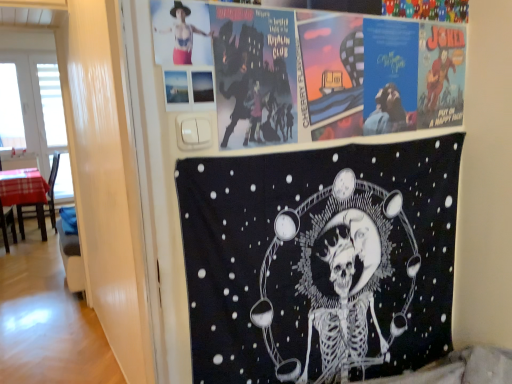
What do you see at coordinates (319, 261) in the screenshot? The width and height of the screenshot is (512, 384). I see `black fabric poster at upper center, the second poster from the top` at bounding box center [319, 261].

You are a GUI agent. You are given a task and a screenshot of the screen. Output one action in this format:
    pyautogui.click(x=<x>, y=<y>)
    Task: Click on the matte black and pink fabric at upper left
    
    Given the screenshot: What is the action you would take?
    pyautogui.click(x=181, y=32)

What is the approximate height of white plastic window screen at left?

It is 2.23 meters.

You are a GUI agent. You are given a task and a screenshot of the screen. Output one action in this format:
    pyautogui.click(x=<x>, y=<y>)
    Task: Click on the white plastic window screen at left
    
    Given the screenshot: What is the action you would take?
    (51, 118)

Describe the element at coordinates (317, 71) in the screenshot. This screenshot has width=512, height=384. I see `matte paper poster at upper center, positioned as the first poster in top-to-bottom order` at that location.

This screenshot has height=384, width=512. What do you see at coordinates (41, 205) in the screenshot?
I see `plaid fabric chair at left` at bounding box center [41, 205].

Find the location of `black fabric poster at upper center, which ranks as the first poster in bottom-to-top order`. black fabric poster at upper center, which ranks as the first poster in bottom-to-top order is located at coordinates (319, 261).

From the image's perspective, is black fabric poster at upper center, the second poster from the top, located above or below white plastic window screen at left?

Based on their image positions, black fabric poster at upper center, the second poster from the top, is located beneath white plastic window screen at left.

In the image, is black fabric poster at upper center, the second poster from the top, positioned in front of or behind white plastic window screen at left?

Clearly, black fabric poster at upper center, the second poster from the top, is in front of white plastic window screen at left.

Between black fabric poster at upper center, the second poster from the top, and white plastic window screen at left, which one has larger width?

With larger width is white plastic window screen at left.

In terms of height, does black fabric poster at upper center, which ranks as the first poster in bottom-to-top order, look taller or shorter compared to white plastic window screen at left?

Clearly, black fabric poster at upper center, which ranks as the first poster in bottom-to-top order, is shorter compared to white plastic window screen at left.

How many degrees apart are the facing directions of plaid fabric chair at left and black fabric poster at upper center, the second poster from the top?

The angular difference between plaid fabric chair at left and black fabric poster at upper center, the second poster from the top, is 86 degrees.

Do you think plaid fabric chair at left is within black fabric poster at upper center, which ranks as the first poster in bottom-to-top order, or outside of it?

The correct answer is: outside.

Is plaid fabric chair at left at the left side of black fabric poster at upper center, the second poster from the top?

Indeed, plaid fabric chair at left is positioned on the left side of black fabric poster at upper center, the second poster from the top.

From a real-world perspective, between plaid fabric chair at left and black fabric poster at upper center, the second poster from the top, who is vertically lower?

plaid fabric chair at left is physically lower.

In the image, is matte paper poster at upper center, the second poster when ordered from bottom to top, positioned in front of or behind matte black and pink fabric at upper left?

Clearly, matte paper poster at upper center, the second poster when ordered from bottom to top, is behind matte black and pink fabric at upper left.

From a real-world perspective, which object rests below the other?

matte paper poster at upper center, positioned as the first poster in top-to-bottom order, from a real-world perspective.

Would you say matte paper poster at upper center, positioned as the first poster in top-to-bottom order, contains matte black and pink fabric at upper left?

No, matte paper poster at upper center, positioned as the first poster in top-to-bottom order, does not contain matte black and pink fabric at upper left.

Is point (348, 44) positioned before point (180, 32)?

No, (348, 44) is further to viewer.

Which is in front, matte black and pink fabric at upper left or matte paper poster at upper center, positioned as the first poster in top-to-bottom order?

matte black and pink fabric at upper left is more forward.

Consider the image. Is matte black and pink fabric at upper left outside of matte paper poster at upper center, positioned as the first poster in top-to-bottom order?

matte black and pink fabric at upper left lies outside matte paper poster at upper center, positioned as the first poster in top-to-bottom order,'s area.

In the scene shown: Is matte black and pink fabric at upper left not near matte paper poster at upper center, the second poster when ordered from bottom to top?

Actually, matte black and pink fabric at upper left and matte paper poster at upper center, the second poster when ordered from bottom to top, are a little close together.

Between matte black and pink fabric at upper left and matte paper poster at upper center, the second poster when ordered from bottom to top, which one has larger size?

With larger size is matte paper poster at upper center, the second poster when ordered from bottom to top.

Measure the distance from black fabric poster at upper center, which ranks as the first poster in bottom-to-top order, to matte paper poster at upper center, positioned as the first poster in top-to-bottom order.

They are 10.80 inches apart.

Do you think black fabric poster at upper center, the second poster from the top, is within matte paper poster at upper center, positioned as the first poster in top-to-bottom order, or outside of it?

black fabric poster at upper center, the second poster from the top, lies outside matte paper poster at upper center, positioned as the first poster in top-to-bottom order.

Identify the location of poster positioned vertically above the black fabric poster at upper center, the second poster from the top (from a real-world perspective). The height and width of the screenshot is (384, 512). (317, 71).

Considering the positions of points (374, 237) and (243, 90), is point (374, 237) closer to camera compared to point (243, 90)?

No, (374, 237) is further to viewer.

What are the coordinates of `person above the black fabric poster at upper center, the second poster from the top (from a real-world perspective)` in the screenshot? It's located at (181, 32).

Consider the image. Is matte black and pink fabric at upper left bigger than black fabric poster at upper center, which ranks as the first poster in bottom-to-top order?

No, matte black and pink fabric at upper left is not bigger than black fabric poster at upper center, which ranks as the first poster in bottom-to-top order.

Consider the image. Considering the sizes of objects matte black and pink fabric at upper left and black fabric poster at upper center, which ranks as the first poster in bottom-to-top order, in the image provided, who is taller, matte black and pink fabric at upper left or black fabric poster at upper center, which ranks as the first poster in bottom-to-top order,?

With more height is black fabric poster at upper center, which ranks as the first poster in bottom-to-top order.

Is matte black and pink fabric at upper left turned away from black fabric poster at upper center, which ranks as the first poster in bottom-to-top order?

No, matte black and pink fabric at upper left is not facing away from black fabric poster at upper center, which ranks as the first poster in bottom-to-top order.

Considering the relative positions of plaid fabric chair at left and matte paper poster at upper center, the second poster when ordered from bottom to top, in the image provided, is plaid fabric chair at left to the left or to the right of matte paper poster at upper center, the second poster when ordered from bottom to top,?

In the image, plaid fabric chair at left appears on the left side of matte paper poster at upper center, the second poster when ordered from bottom to top.

Considering the sizes of objects plaid fabric chair at left and matte paper poster at upper center, positioned as the first poster in top-to-bottom order, in the image provided, who is taller, plaid fabric chair at left or matte paper poster at upper center, positioned as the first poster in top-to-bottom order,?

plaid fabric chair at left is taller.

Which of these two, plaid fabric chair at left or matte paper poster at upper center, the second poster when ordered from bottom to top, is thinner?

matte paper poster at upper center, the second poster when ordered from bottom to top, is thinner.

Is plaid fabric chair at left positioned in front of matte paper poster at upper center, the second poster when ordered from bottom to top?

No, plaid fabric chair at left is behind matte paper poster at upper center, the second poster when ordered from bottom to top.

Where is `the 1st poster counting from the right side of the white plastic window screen at left`? the 1st poster counting from the right side of the white plastic window screen at left is located at coordinates (319, 261).

Where is `chair that is under the black fabric poster at upper center, the second poster from the top (from a real-world perspective)`? The height and width of the screenshot is (384, 512). chair that is under the black fabric poster at upper center, the second poster from the top (from a real-world perspective) is located at coordinates (41, 205).

Which object lies further to the anchor point white plastic window screen at left, matte paper poster at upper center, positioned as the first poster in top-to-bottom order, or black fabric poster at upper center, the second poster from the top?

matte paper poster at upper center, positioned as the first poster in top-to-bottom order.

Considering their positions, is matte black and pink fabric at upper left positioned closer to white plastic window screen at left than plaid fabric chair at left?

Based on the image, plaid fabric chair at left appears to be nearer to white plastic window screen at left.

From the picture: Which object lies nearer to the anchor point black fabric poster at upper center, which ranks as the first poster in bottom-to-top order, plaid fabric chair at left or matte paper poster at upper center, positioned as the first poster in top-to-bottom order?

Based on the image, matte paper poster at upper center, positioned as the first poster in top-to-bottom order, appears to be nearer to black fabric poster at upper center, which ranks as the first poster in bottom-to-top order.

Estimate the real-world distances between objects in this image. Which object is closer to matte black and pink fabric at upper left, white plastic window screen at left or matte paper poster at upper center, the second poster when ordered from bottom to top?

Based on the image, matte paper poster at upper center, the second poster when ordered from bottom to top, appears to be nearer to matte black and pink fabric at upper left.

From the image, which object appears to be farther from matte paper poster at upper center, positioned as the first poster in top-to-bottom order, plaid fabric chair at left or white plastic window screen at left?

Based on the image, white plastic window screen at left appears to be further to matte paper poster at upper center, positioned as the first poster in top-to-bottom order.

Based on the photo, which object lies further to the anchor point plaid fabric chair at left, white plastic window screen at left or matte black and pink fabric at upper left?

matte black and pink fabric at upper left is further to plaid fabric chair at left.

Considering their positions, is matte black and pink fabric at upper left positioned closer to black fabric poster at upper center, which ranks as the first poster in bottom-to-top order, than matte paper poster at upper center, the second poster when ordered from bottom to top?

matte paper poster at upper center, the second poster when ordered from bottom to top, lies closer to black fabric poster at upper center, which ranks as the first poster in bottom-to-top order, than the other object.

Which object lies further to the anchor point white plastic window screen at left, plaid fabric chair at left or matte black and pink fabric at upper left?

matte black and pink fabric at upper left lies further to white plastic window screen at left than the other object.

The image size is (512, 384). What are the coordinates of `poster that lies between matte black and pink fabric at upper left and black fabric poster at upper center, which ranks as the first poster in bottom-to-top order, from top to bottom` in the screenshot? It's located at (317, 71).

This screenshot has height=384, width=512. Find the location of `chair between matte black and pink fabric at upper left and white plastic window screen at left from front to back`. chair between matte black and pink fabric at upper left and white plastic window screen at left from front to back is located at coordinates (41, 205).

Identify the location of chair between matte paper poster at upper center, the second poster when ordered from bottom to top, and white plastic window screen at left from front to back. (41, 205).

This screenshot has width=512, height=384. In order to click on chair between black fabric poster at upper center, which ranks as the first poster in bottom-to-top order, and white plastic window screen at left from front to back in this screenshot , I will do `click(41, 205)`.